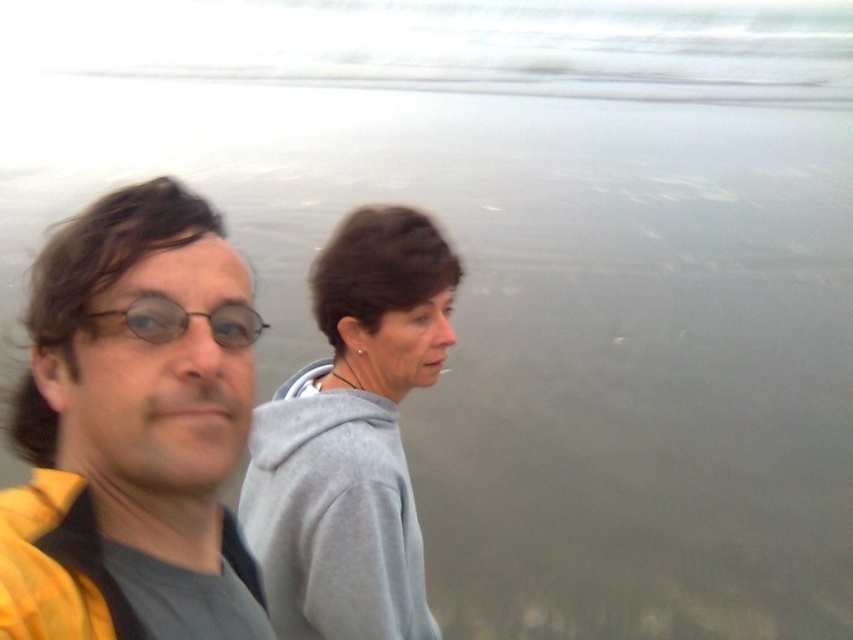
Does point (143, 257) come closer to viewer compared to point (212, 310)?

Yes, point (143, 257) is in front of point (212, 310).

Is yellow fabric at left positioned in front of matte black glasses at left?

That is True.

I want to click on yellow fabric at left, so click(126, 422).

Find the location of a particular element. yellow fabric at left is located at coordinates (126, 422).

Can you confirm if gray fleece at center is positioned below matte black glasses at left?

Yes.

Who is positioned more to the left, gray fleece at center or matte black glasses at left?

matte black glasses at left

Is point (399, 552) closer to camera compared to point (213, 323)?

No.

Find the location of `gray fleece at center`. gray fleece at center is located at coordinates (351, 438).

Which is more to the left, yellow fabric at left or gray fleece at center?

yellow fabric at left

Which is above, yellow fabric at left or gray fleece at center?

yellow fabric at left is above.

Locate an element on the screen. yellow fabric at left is located at coordinates (126, 422).